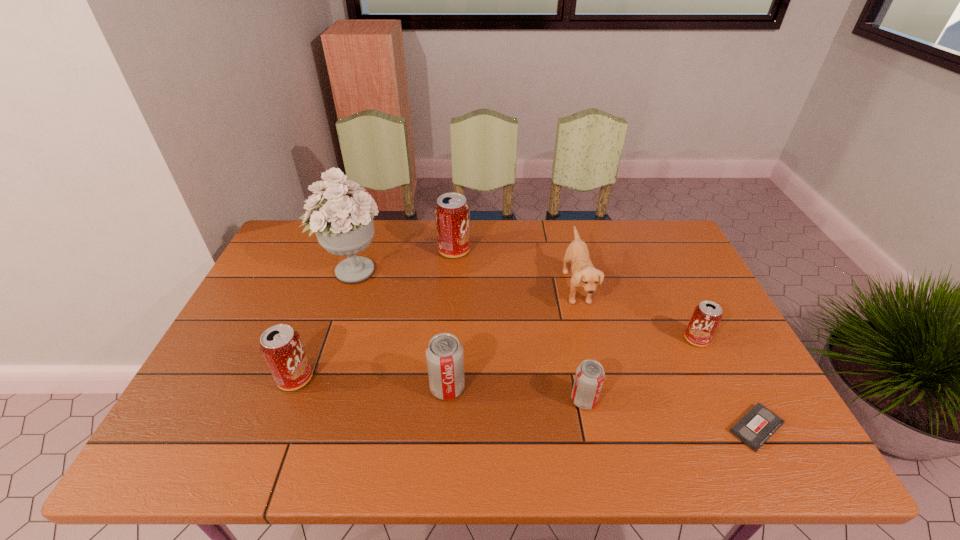
What are the coordinates of `the closest red soda can to the leftmost red soda can` in the screenshot? It's located at [x=452, y=213].

This screenshot has width=960, height=540. Find the location of `red soda can identified as the closest to the nearest red soda can`. red soda can identified as the closest to the nearest red soda can is located at coordinates (452, 213).

Find the location of a particular element. vacant region that satisfies the following two spatial constraints: 1. on the front side of the green bouquet; 2. on the left side of the right gray soda can is located at coordinates (308, 400).

Locate an element on the screen. free space that satisfies the following two spatial constraints: 1. on the front side of the bigger gray soda can; 2. on the right side of the videotape is located at coordinates (444, 428).

This screenshot has width=960, height=540. I want to click on vacant point that satisfies the following two spatial constraints: 1. on the back side of the leftmost red soda can; 2. on the right side of the tallest object, so click(x=336, y=271).

Where is `vacant point that satisfies the following two spatial constraints: 1. on the left side of the puppy; 2. on the front side of the smaller gray soda can`? vacant point that satisfies the following two spatial constraints: 1. on the left side of the puppy; 2. on the front side of the smaller gray soda can is located at coordinates (604, 400).